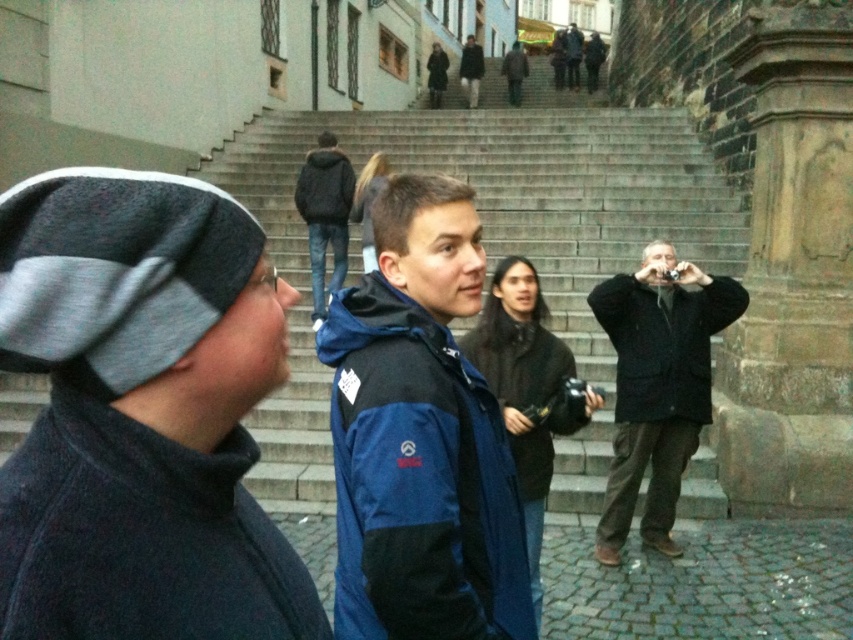
You are a photographer trying to capture a photo of the black fuzzy jacket at upper center. Based on the coordinates provided, where should you aim your camera to ensure the jacket is centered in the frame?

The black fuzzy jacket at upper center is located at coordinates point (325,214), so aim your camera at that point to center it in the frame.

You are standing at point [581,44] and want to walk to point [315,241]. Which direction should you move relative to your current position?

You should move forward because point [315,241] is in front of point [581,44].

You are standing at the base of the smooth stone stairs at center and want to join the person wearing the black matte sweatshirt at center. In which direction should you move to reach them?

The smooth stone stairs at center is to the left of the black matte sweatshirt at center, so you should move to the right to reach them.